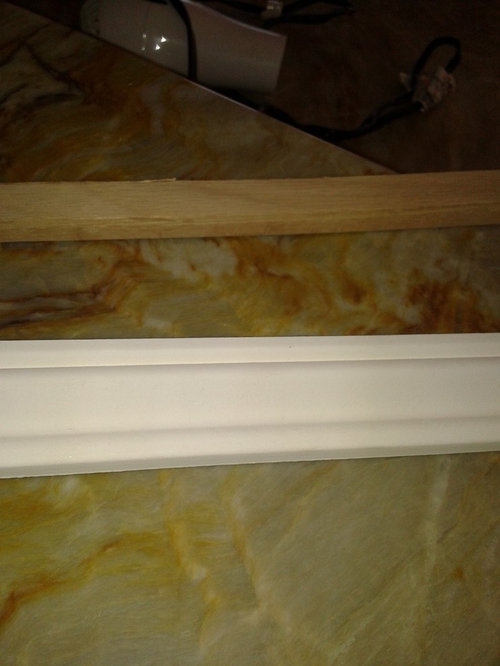
Locate an element on the screen. This screenshot has height=666, width=500. hairdryer is located at coordinates (218, 55).